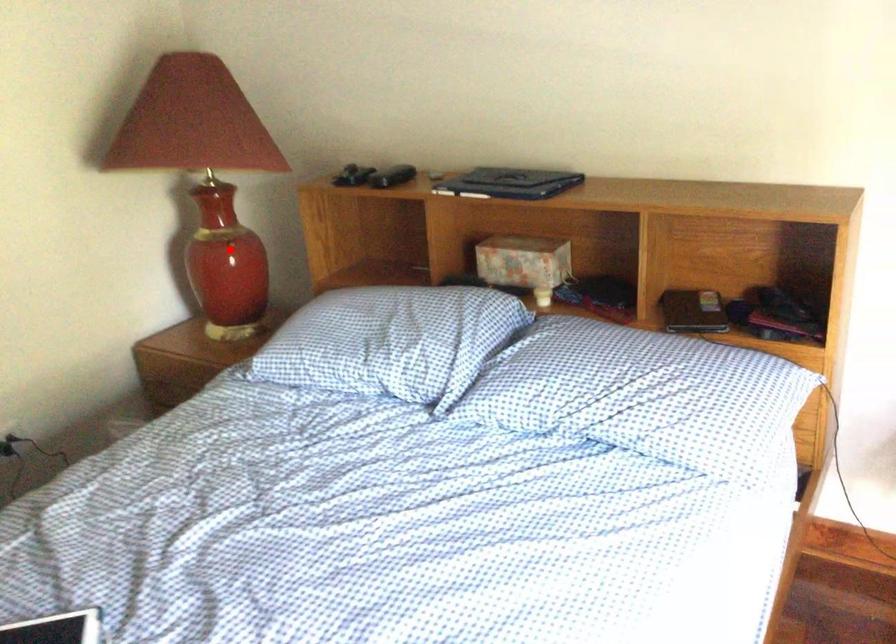
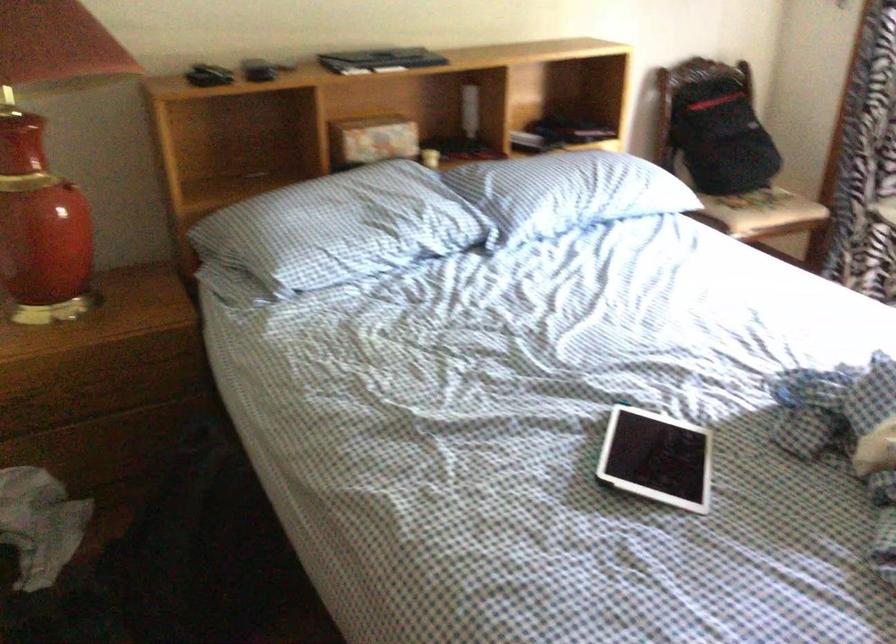
Question: I am providing you with two images of the same scene from different viewpoints. A red point is marked on the first image. Is the red point's position out of view in image 2?

Choices:
 (A) Yes
 (B) No

Answer: (A)